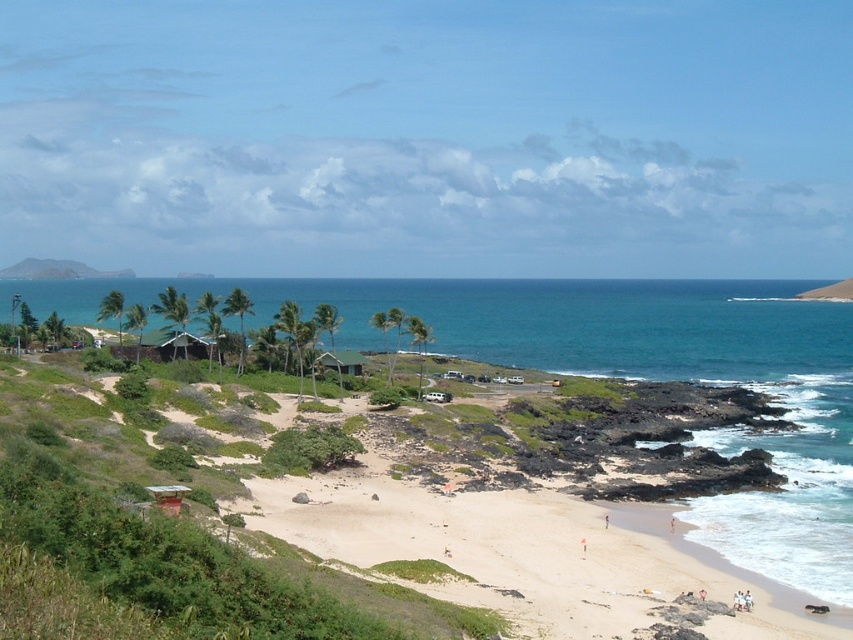
You are standing on the beach and want to take a photo of the blue water at center and the green matte hut at center. Which object should you focus on first to ensure both are in the frame?

The blue water at center is in front of the green matte hut at center, so you should focus on the green matte hut at center first to ensure both are in the frame.

You are planning to build a small boat dock near the green matte hut at center. Since the blue water at center is deeper here, will the dock be stable enough to hold a boat?

The blue water at center has a larger size compared to the green matte hut at center, which indicates it is deeper. Therefore, the dock built near the green matte hut at center will be stable enough to hold a boat as deeper water typically provides better stability.